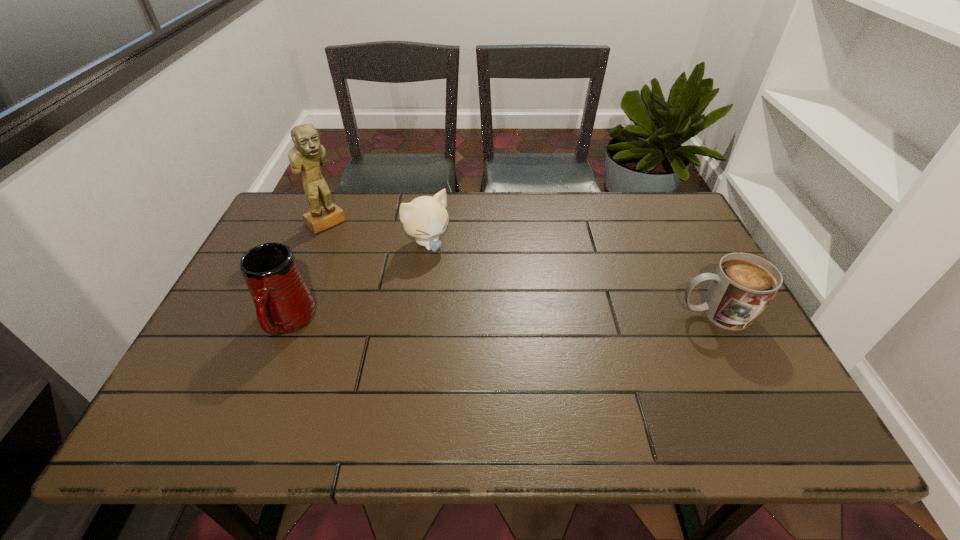
At what (x,y) coordinates should I click in order to perform the action: click on object positioned at the far left corner. Please return your answer as a coordinate pair (x, y). The height and width of the screenshot is (540, 960). Looking at the image, I should click on (307, 154).

In the image, there is a desktop. Where is `vacant space at the far edge`? vacant space at the far edge is located at coordinates (388, 193).

Image resolution: width=960 pixels, height=540 pixels. Find the location of `vacant space at the near edge of the desktop`. vacant space at the near edge of the desktop is located at coordinates (492, 370).

Locate an element on the screen. vacant space at the left edge of the desktop is located at coordinates (291, 242).

This screenshot has width=960, height=540. I want to click on vacant area at the far left corner of the desktop, so click(278, 237).

This screenshot has height=540, width=960. In order to click on free point at the near left corner in this screenshot , I will do `click(197, 381)`.

Identify the location of free space at the far right corner of the desktop. (681, 238).

The height and width of the screenshot is (540, 960). Identify the location of empty location between the kitten and the left mug. (358, 283).

Image resolution: width=960 pixels, height=540 pixels. What are the coordinates of `vacant space that's between the tallest object and the right mug` in the screenshot? It's located at (520, 268).

Locate an element on the screen. The width and height of the screenshot is (960, 540). vacant area between the right mug and the third object from left to right is located at coordinates (571, 279).